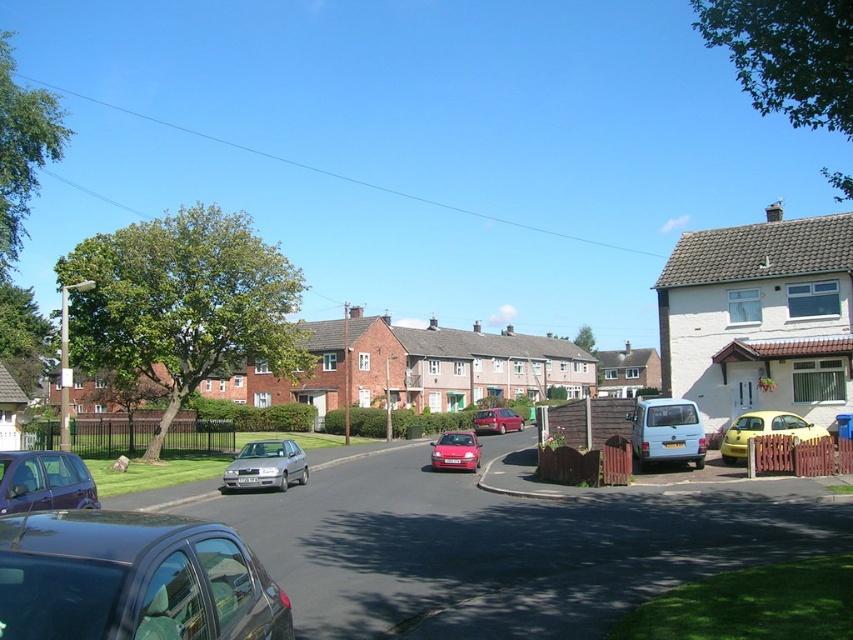
Question: Is light blue matte van at center-right wider than shiny red car at center?

Choices:
 (A) no
 (B) yes

Answer: (A)

Question: Based on their relative distances, which object is nearer to the silver metallic hatchback at lower left?

Choices:
 (A) shiny red car at center
 (B) shiny black car at lower left
 (C) metallic red car at center
 (D) yellow matte car at right

Answer: (A)

Question: In this image, where is silver metallic hatchback at lower left located relative to metallic red car at center?

Choices:
 (A) left
 (B) right

Answer: (A)

Question: Estimate the real-world distances between objects in this image. Which object is farther from the silver metallic hatchback at lower left?

Choices:
 (A) yellow matte car at right
 (B) metallic red car at center

Answer: (B)

Question: Which object is farther from the camera taking this photo?

Choices:
 (A) yellow matte car at right
 (B) metallic blue hatchback at lower left

Answer: (A)

Question: Can you confirm if light blue matte van at center-right is positioned above metallic red car at center?

Choices:
 (A) no
 (B) yes

Answer: (B)